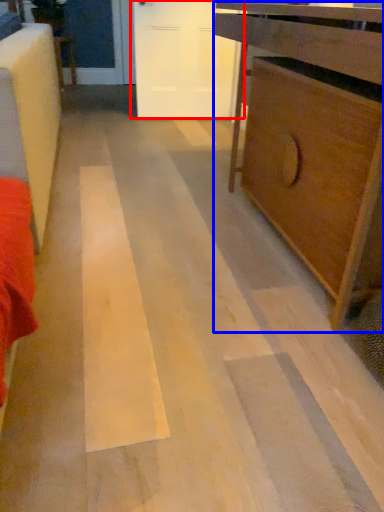
Question: Which of the following is the closest to the observer, door (highlighted by a red box) or chest of drawers (highlighted by a blue box)?

Choices:
 (A) door
 (B) chest of drawers

Answer: (B)